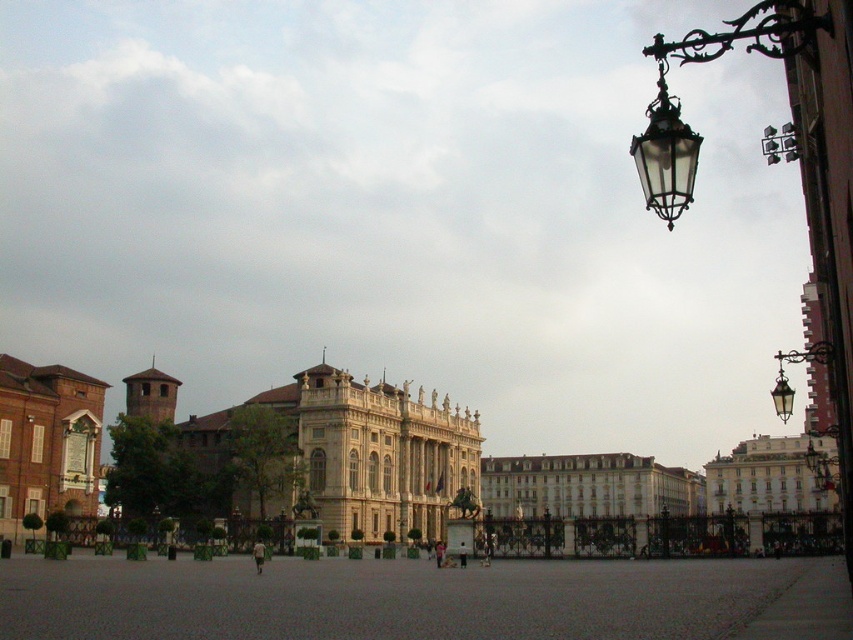
Question: Which point is closer to the camera taking this photo?

Choices:
 (A) click(x=633, y=540)
 (B) click(x=77, y=456)

Answer: (B)

Question: Which of the following is the closest to the observer?

Choices:
 (A) (692, 472)
 (B) (305, 380)
 (C) (28, 493)

Answer: (C)

Question: Which point appears farthest from the camera in this image?

Choices:
 (A) (405, 397)
 (B) (100, 429)

Answer: (A)

Question: Can you confirm if beige stone palace at center is positioned to the right of brick wall at left?

Choices:
 (A) no
 (B) yes

Answer: (B)

Question: Can you confirm if white glossy building at center is wider than brick wall at left?

Choices:
 (A) no
 (B) yes

Answer: (B)

Question: Does white glossy building at center have a smaller size compared to brick wall at left?

Choices:
 (A) no
 (B) yes

Answer: (A)